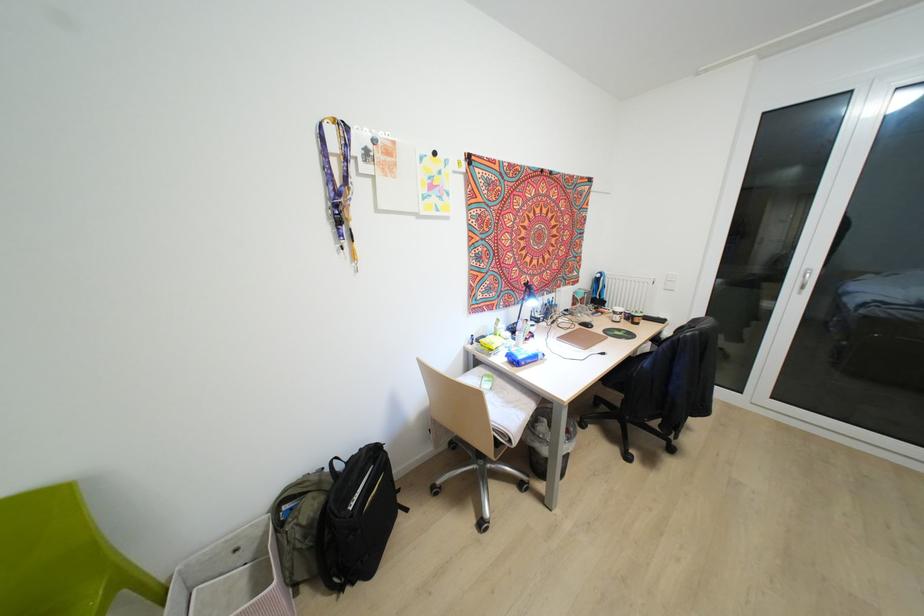
What do you see at coordinates (805, 280) in the screenshot?
I see `a white door handle` at bounding box center [805, 280].